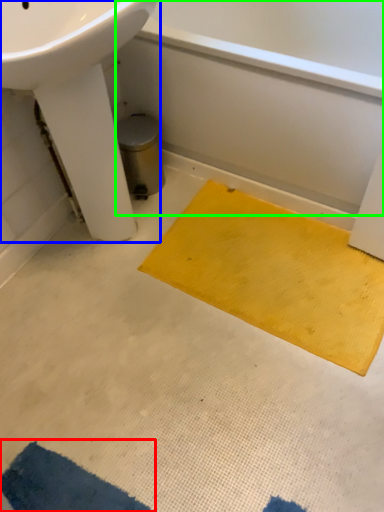
Question: Which object is the farthest from doormat (highlighted by a red box)? Choose among these: sink (highlighted by a blue box) or bath (highlighted by a green box).

Choices:
 (A) sink
 (B) bath

Answer: (B)